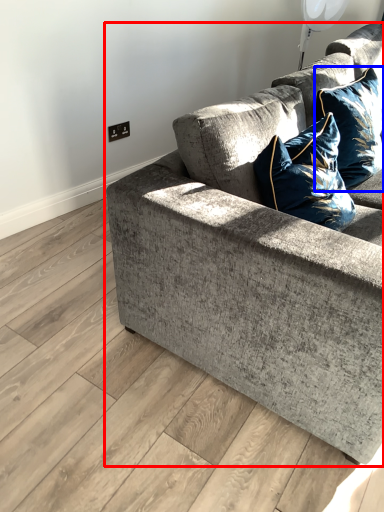
Question: Which object is further to the camera taking this photo, studio couch (highlighted by a red box) or pillow (highlighted by a blue box)?

Choices:
 (A) studio couch
 (B) pillow

Answer: (B)